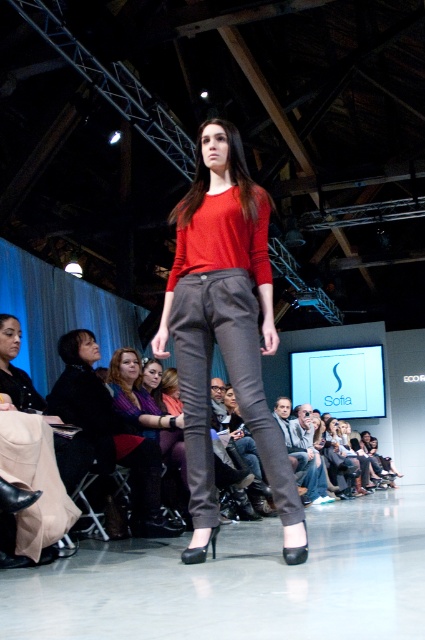
Question: Estimate the real-world distances between objects in this image. Which object is farther from the matte purple sweater at center?

Choices:
 (A) matte red sweater at center
 (B) matte gray pants at center
 (C) matte black pants at center

Answer: (B)

Question: Is matte black pants at center below matte gray pants at center?

Choices:
 (A) no
 (B) yes

Answer: (A)

Question: Is matte red sweater at center to the left of matte gray pants at center from the viewer's perspective?

Choices:
 (A) yes
 (B) no

Answer: (A)

Question: Which point is closer to the camera taking this photo?

Choices:
 (A) (150, 422)
 (B) (56, 400)
 (C) (357, 483)

Answer: (B)

Question: Can you confirm if matte red sweater at center is bigger than matte purple sweater at center?

Choices:
 (A) no
 (B) yes

Answer: (A)

Question: Among these objects, which one is farthest from the camera?

Choices:
 (A) matte gray pants at center
 (B) matte purple sweater at center

Answer: (A)